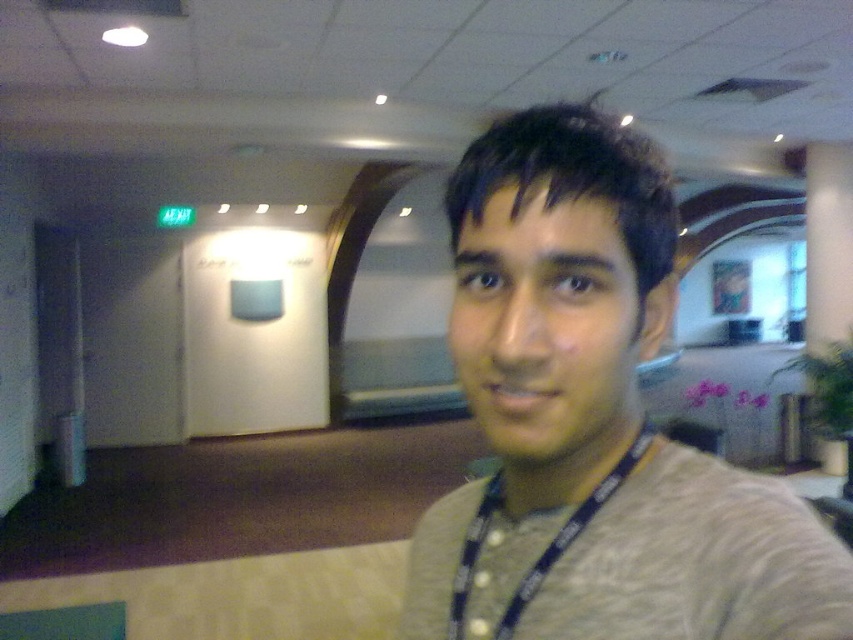
Who is more forward, (773, 483) or (643, 438)?

Positioned in front is point (773, 483).

Who is higher up, gray cotton shirt at center or blue fabric lanyard at center?

Positioned higher is gray cotton shirt at center.

At what (x,y) coordinates should I click in order to perform the action: click on gray cotton shirt at center. Please return your answer as a coordinate pair (x, y). Looking at the image, I should click on (593, 422).

In order to click on gray cotton shirt at center in this screenshot , I will do `click(593, 422)`.